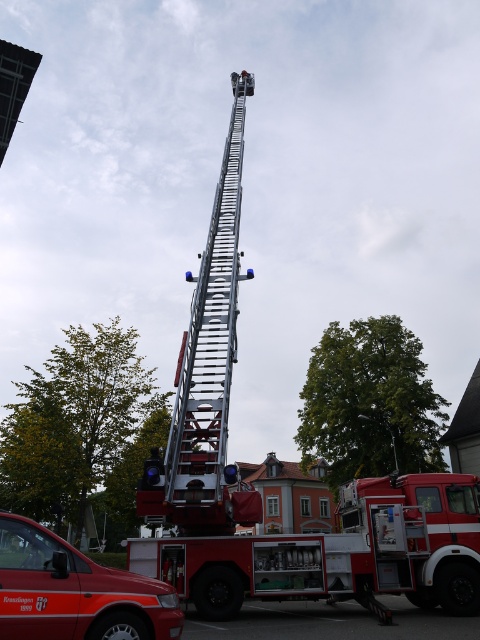
Is metallic silver ladder at center below matte red van at lower left?

Yes, metallic silver ladder at center is below matte red van at lower left.

How far apart are metallic silver ladder at center and matte red van at lower left?

metallic silver ladder at center and matte red van at lower left are 6.49 meters apart.

Who is more distant from viewer, [211,304] or [127,579]?

The point [211,304] is more distant.

You are a GUI agent. You are given a task and a screenshot of the screen. Output one action in this format:
    pyautogui.click(x=<x>, y=<y>)
    Task: Click on the metallic silver ladder at center
    Image resolution: width=480 pixels, height=640 pixels.
    Given the screenshot: What is the action you would take?
    click(257, 492)

I want to click on metallic silver ladder at center, so click(x=257, y=492).

Find the location of `metallic silver ladder at center`. metallic silver ladder at center is located at coordinates (257, 492).

Is silver metallic ladder at upper center positioned behind matte red van at lower left?

That is True.

Who is taller, silver metallic ladder at upper center or matte red van at lower left?

silver metallic ladder at upper center

Describe the element at coordinates (210, 339) in the screenshot. I see `silver metallic ladder at upper center` at that location.

You are a GUI agent. You are given a task and a screenshot of the screen. Output one action in this format:
    pyautogui.click(x=<x>, y=<y>)
    Task: Click on the silver metallic ladder at upper center
    This screenshot has width=480, height=640.
    Given the screenshot: What is the action you would take?
    pyautogui.click(x=210, y=339)